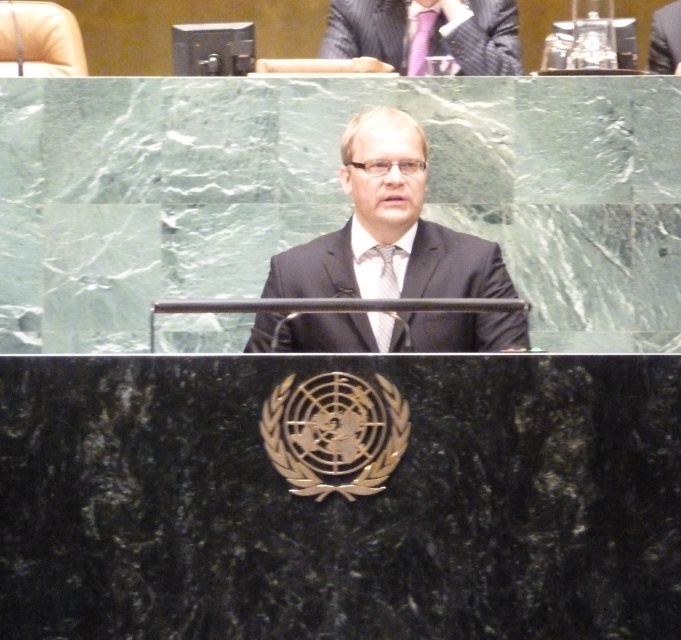
You are a fashion designer observing the speaker in the scene. You notice two ties on him. Which tie is positioned closer to you, the matte silver tie at center or the purple satin tie at upper center?

The matte silver tie at center is closer to the viewer than the purple satin tie at upper center.

You are standing in the conference room and want to move from point A to point B. Point A is located at coordinates point (x=381, y=250) and point B is at point (x=394, y=291). Which point is closer to you?

Point (x=381, y=250) is closer to you because it is further to the viewer than point (x=394, y=291).